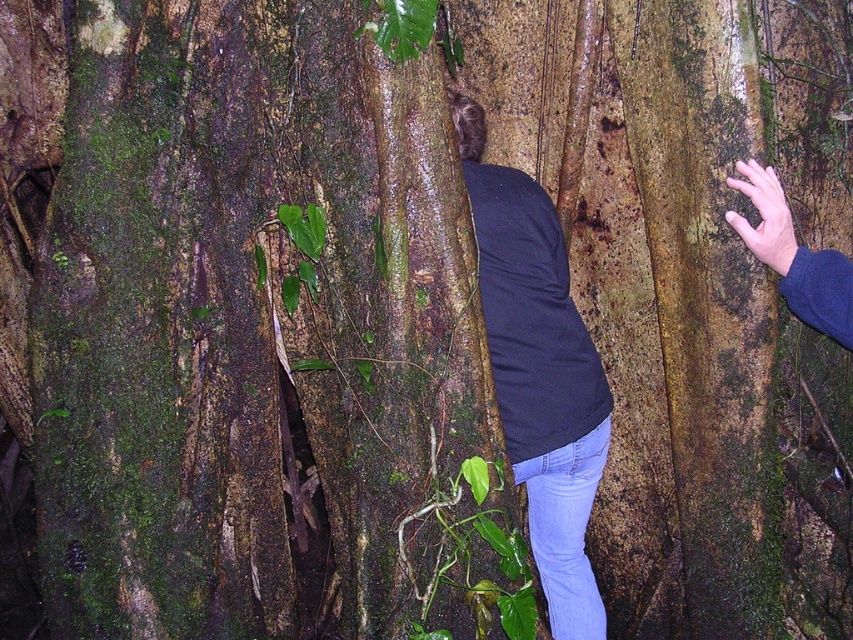
Question: Which point is closer to the camera taking this photo?

Choices:
 (A) (762, 180)
 (B) (560, 557)

Answer: (A)

Question: Is dark blue shirt at center in front of blue fabric hand at right?

Choices:
 (A) no
 (B) yes

Answer: (A)

Question: Is the position of dark blue shirt at center more distant than that of blue fabric hand at right?

Choices:
 (A) yes
 (B) no

Answer: (A)

Question: Can you confirm if dark blue shirt at center is smaller than blue fabric hand at right?

Choices:
 (A) yes
 (B) no

Answer: (B)

Question: Which point is farther to the camera?

Choices:
 (A) tap(492, 214)
 (B) tap(824, 332)

Answer: (A)